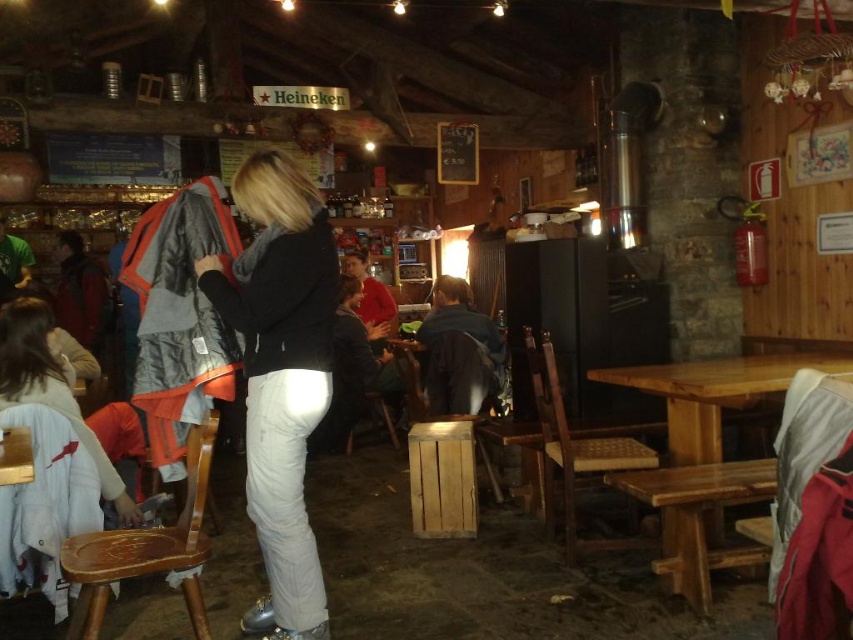
Question: Can you confirm if white matte pants at center is positioned above wooden table at lower right?

Choices:
 (A) yes
 (B) no

Answer: (A)

Question: Can you confirm if white matte pants at center is bigger than wooden table at lower right?

Choices:
 (A) yes
 (B) no

Answer: (B)

Question: Which object appears farthest from the camera in this image?

Choices:
 (A) white matte pants at center
 (B) wooden table at lower right

Answer: (B)

Question: Is white matte pants at center wider than wooden table at lower right?

Choices:
 (A) yes
 (B) no

Answer: (B)